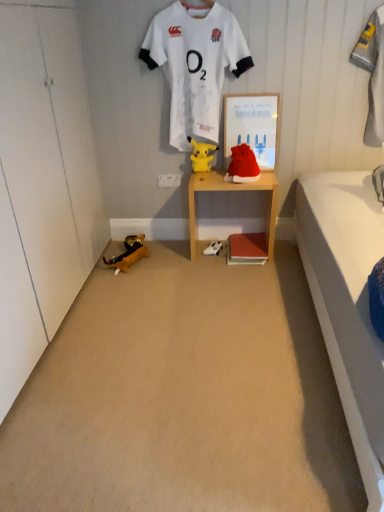
Question: Does yellow plush toy at center, the 3th toy from the bottom, have a greater width compared to white jersey at upper center?

Choices:
 (A) no
 (B) yes

Answer: (A)

Question: Can you confirm if yellow plush toy at center, the 2th toy viewed from the right, is smaller than white jersey at upper center?

Choices:
 (A) yes
 (B) no

Answer: (A)

Question: Is yellow plush toy at center, which appears as the 1th toy when viewed from the top, at the left side of white jersey at upper center?

Choices:
 (A) yes
 (B) no

Answer: (B)

Question: From the image's perspective, is yellow plush toy at center, which appears as the 1th toy when viewed from the top, under white jersey at upper center?

Choices:
 (A) yes
 (B) no

Answer: (A)

Question: Could you tell me if yellow plush toy at center, which is the second toy in left-to-right order, is turned towards white jersey at upper center?

Choices:
 (A) no
 (B) yes

Answer: (B)

Question: Considering the relative sizes of yellow plush toy at center, which appears as the 1th toy when viewed from the top, and white jersey at upper center in the image provided, is yellow plush toy at center, which appears as the 1th toy when viewed from the top, bigger than white jersey at upper center?

Choices:
 (A) yes
 (B) no

Answer: (B)

Question: From the image's perspective, does white fabric shoe at lower center appear lower than gray fabric towel at upper right?

Choices:
 (A) no
 (B) yes

Answer: (B)

Question: Does white fabric shoe at lower center have a lesser width compared to gray fabric towel at upper right?

Choices:
 (A) yes
 (B) no

Answer: (B)

Question: Can you confirm if white fabric shoe at lower center is positioned to the left of gray fabric towel at upper right?

Choices:
 (A) yes
 (B) no

Answer: (A)

Question: Considering the relative positions of white fabric shoe at lower center and gray fabric towel at upper right in the image provided, is white fabric shoe at lower center in front of gray fabric towel at upper right?

Choices:
 (A) no
 (B) yes

Answer: (A)

Question: Is white fabric shoe at lower center touching gray fabric towel at upper right?

Choices:
 (A) yes
 (B) no

Answer: (B)

Question: Can you confirm if white fabric shoe at lower center is bigger than gray fabric towel at upper right?

Choices:
 (A) no
 (B) yes

Answer: (A)

Question: Can you confirm if wooden shelf at center is bigger than white jersey at upper center?

Choices:
 (A) no
 (B) yes

Answer: (B)